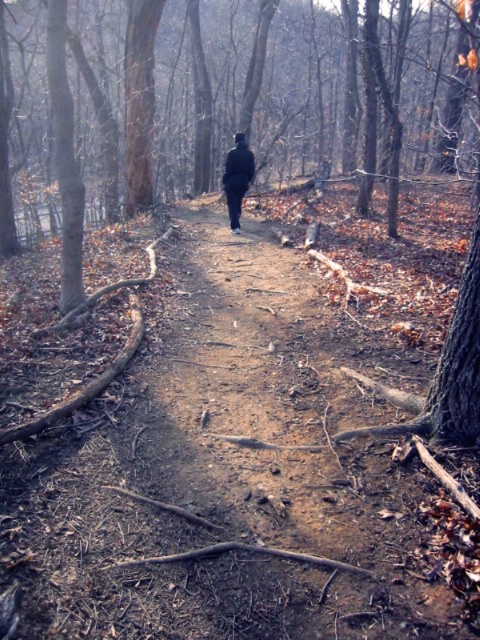
Is dirt path at center shorter than dark matte coat at center?

In fact, dirt path at center may be taller than dark matte coat at center.

You are a GUI agent. You are given a task and a screenshot of the screen. Output one action in this format:
    pyautogui.click(x=<x>, y=<y>)
    Task: Click on the dirt path at center
    The width and height of the screenshot is (480, 640).
    Given the screenshot: What is the action you would take?
    pyautogui.click(x=241, y=452)